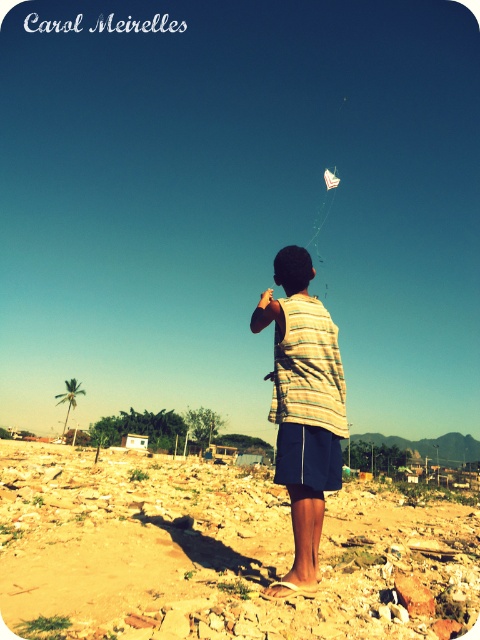
Question: Is brown rocky dirt at center above striped fabric shirt at center?

Choices:
 (A) yes
 (B) no

Answer: (B)

Question: Estimate the real-world distances between objects in this image. Which object is closer to the white paper kite at upper center?

Choices:
 (A) striped fabric shirt at center
 (B) brown rocky dirt at center

Answer: (B)

Question: Which point is closer to the camera taking this photo?

Choices:
 (A) (104, 508)
 (B) (312, 442)

Answer: (B)

Question: Is brown rocky dirt at center positioned at the back of white paper kite at upper center?

Choices:
 (A) no
 (B) yes

Answer: (A)

Question: Based on their relative distances, which object is farther from the striped fabric shirt at center?

Choices:
 (A) brown rocky dirt at center
 (B) white paper kite at upper center

Answer: (B)

Question: Can you confirm if brown rocky dirt at center is positioned above white paper kite at upper center?

Choices:
 (A) yes
 (B) no

Answer: (B)